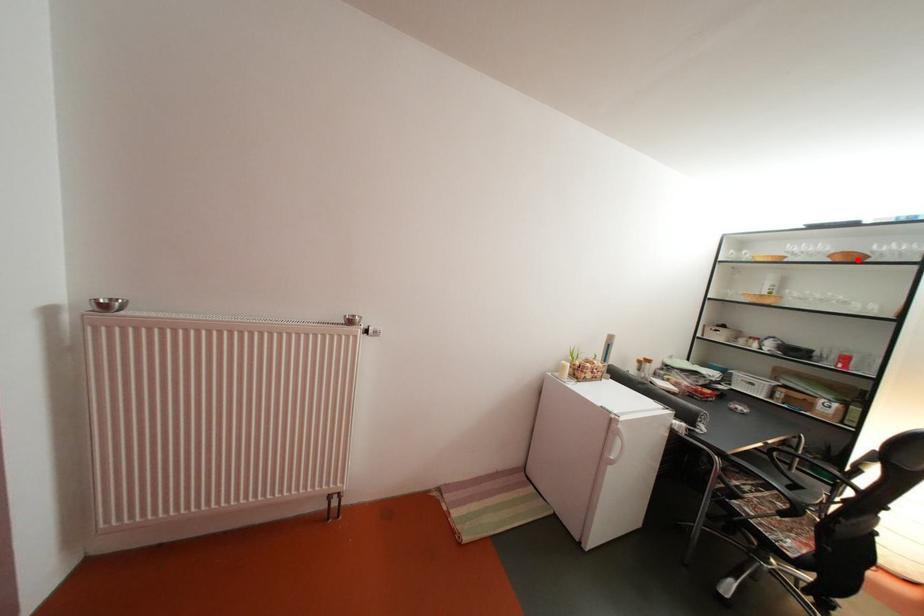
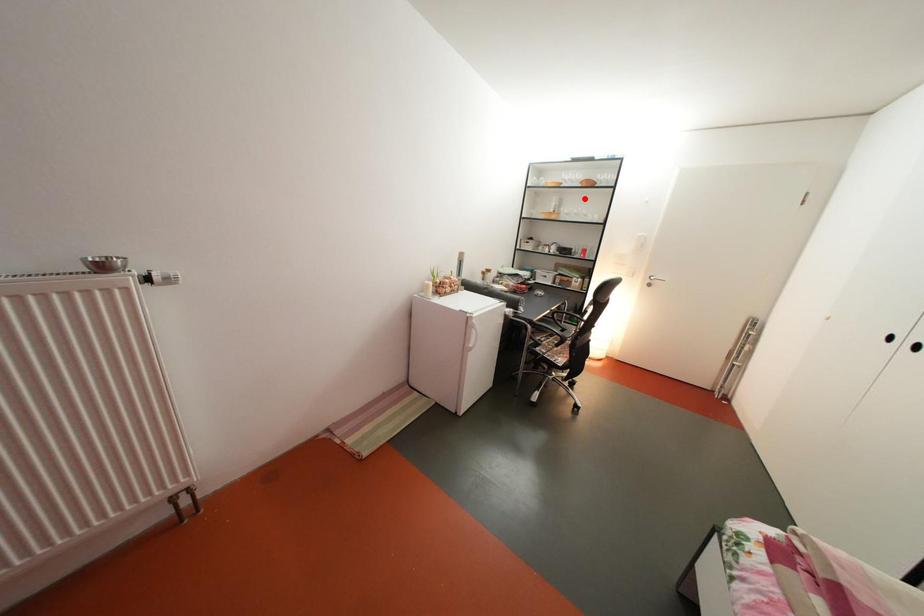
I am providing you with two images of the same scene from different viewpoints. A red point is marked on the first image and another point is marked on the second image. Is the marked point in image1 the same physical position as the marked point in image2?

No